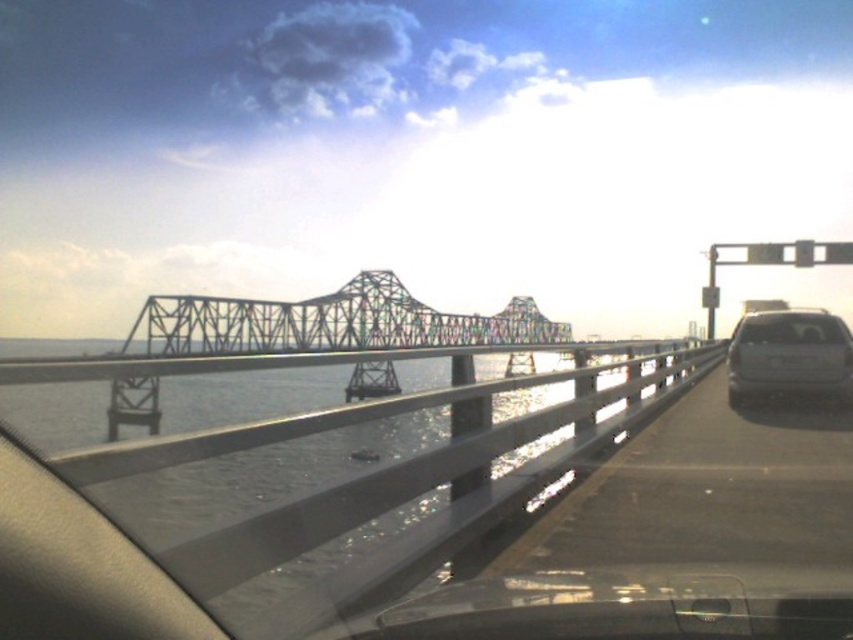
You are a passenger in the satin silver sedan at right and want to take a photo of the clear water at bridge center. Based on their sizes, which object should you zoom in on to capture the entire scene without cropping?

The clear water at bridge center is larger in size than the satin silver sedan at right, so you should zoom out to capture the entire clear water at bridge center without cropping.

You are driving a car and want to know how far the clear water at bridge center is from your car. Can you determine the distance using the available information?

The clear water at bridge center is 7.90 feet away from the camera, so the distance from your car to the clear water at bridge center is approximately 7.90 feet.